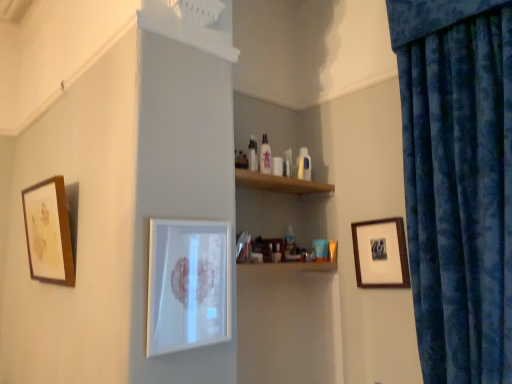
Question: Considering the positions of point (470, 102) and point (156, 246), is point (470, 102) closer or farther from the camera than point (156, 246)?

Choices:
 (A) closer
 (B) farther

Answer: (B)

Question: Considering the relative positions of velvety blue curtain at right and white glossy picture frame at center, placed as the 2th picture frame when sorted from right to left, in the image provided, is velvety blue curtain at right to the left or to the right of white glossy picture frame at center, placed as the 2th picture frame when sorted from right to left,?

Choices:
 (A) right
 (B) left

Answer: (A)

Question: Which is farther from the white glossy picture frame at center, placed as the 2th picture frame when sorted from right to left?

Choices:
 (A) velvety blue curtain at right
 (B) wooden framed print at right, which is the 1th picture frame in right-to-left order
 (C) wooden framed artwork at left, the first picture frame from the left

Answer: (A)

Question: Which of these objects is positioned closest to the wooden framed print at right, the third picture frame in the left-to-right sequence?

Choices:
 (A) white glossy picture frame at center, the 2th picture frame from the left
 (B) wooden framed artwork at left, positioned as the 3th picture frame in right-to-left order
 (C) velvety blue curtain at right

Answer: (C)